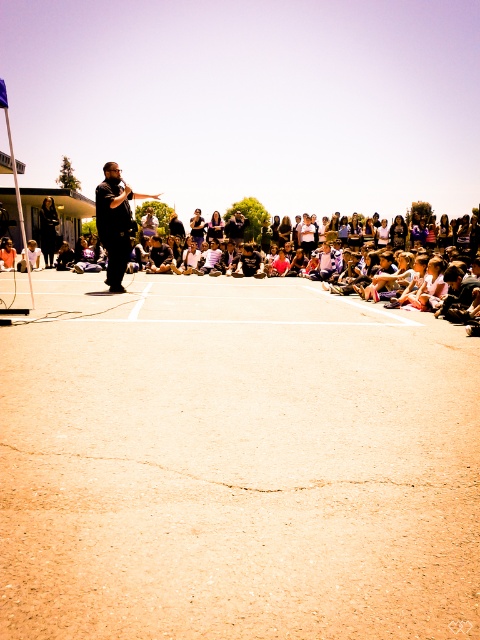
You are a photographer trying to capture a clear shot of the white cotton shirt at center and the black fabric at center. Which one should you focus on first if you want to ensure both are in focus?

The black fabric at center is below the white cotton shirt at center, so you should focus on the white cotton shirt at center first to ensure both are in focus.

You are standing at point (109, 269) and want to walk to the flagpole on the left side of the frame. Which direction should you move relative to point (171, 321)?

Since point (171, 321) is in front of point (109, 269), you should move behind point (171, 321) to reach the flagpole on the left side of the frame.

You are a photographer trying to capture a photo of the two people in the scene wearing a black matte shirt at center and a white cotton shirt at center. Which one is positioned to the left?

The black matte shirt at center is to the left of the white cotton shirt at center, so the person wearing the black matte shirt at center is positioned to the left.